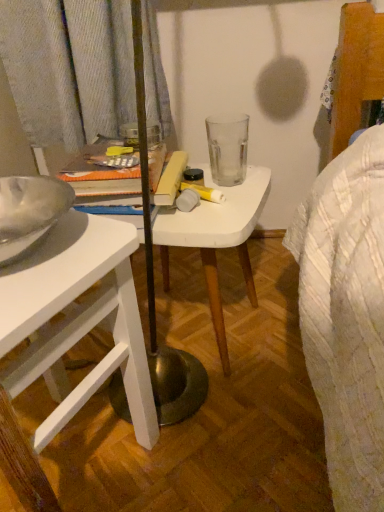
What do you see at coordinates (217, 240) in the screenshot?
I see `white matte table at center` at bounding box center [217, 240].

Find the location of a particular element. white matte table at center is located at coordinates (217, 240).

Based on the photo, what is the approximate height of white matte desk at left?

It is 17.75 inches.

What do you see at coordinates (70, 338) in the screenshot?
I see `white matte desk at left` at bounding box center [70, 338].

At what (x,y) coordinates should I click in order to perform the action: click on white matte desk at left. Please return your answer as a coordinate pair (x, y). Looking at the image, I should click on (70, 338).

The width and height of the screenshot is (384, 512). Identify the location of white matte table at center. (217, 240).

Is white matte table at center to the left or to the right of white matte desk at left in the image?

white matte table at center is positioned on white matte desk at left's right side.

Between white matte table at center and white matte desk at left, which one is positioned behind?

Positioned behind is white matte table at center.

Considering the points (203, 261) and (64, 240), which point is in front, point (203, 261) or point (64, 240)?

The point (64, 240) is closer.

From the image's perspective, which one is positioned higher, white matte table at center or white matte desk at left?

white matte table at center, from the image's perspective.

From a real-world perspective, does white matte table at center sit lower than white matte desk at left?

Yes, from a real-world perspective, white matte table at center is beneath white matte desk at left.

Which object is wider, white matte table at center or white matte desk at left?

With larger width is white matte desk at left.

From the picture: Is white matte table at center taller than white matte desk at left?

Incorrect, the height of white matte table at center is not larger of that of white matte desk at left.

Is white matte table at center smaller than white matte desk at left?

Correct, white matte table at center occupies less space than white matte desk at left.

Is white matte table at center situated inside white matte desk at left or outside?

white matte table at center lies outside white matte desk at left.

Would you say white matte table at center is a long distance from white matte desk at left?

No, white matte table at center is not far away from white matte desk at left.

Is white matte table at center turned away from white matte desk at left?

No.

I want to click on desk to the left of white matte table at center, so click(x=70, y=338).

In the image, is white matte desk at left on the left side or the right side of white matte table at center?

white matte desk at left is positioned on white matte table at center's left side.

Is white matte desk at left further to the viewer compared to white matte table at center?

No, white matte desk at left is closer to the camera.

Which is behind, point (13, 412) or point (208, 220)?

Point (208, 220)

From the image's perspective, which object appears higher, white matte desk at left or white matte table at center?

white matte table at center, from the image's perspective.

From a real-world perspective, is white matte desk at left positioned over white matte table at center based on gravity?

Indeed, from a real-world perspective, white matte desk at left stands above white matte table at center.

Considering the relative sizes of white matte desk at left and white matte table at center in the image provided, is white matte desk at left wider than white matte table at center?

Yes.

In terms of height, does white matte desk at left look taller or shorter compared to white matte table at center?

In the image, white matte desk at left appears to be taller than white matte table at center.

Considering the sizes of objects white matte desk at left and white matte table at center in the image provided, who is smaller, white matte desk at left or white matte table at center?

With smaller size is white matte table at center.

Is white matte desk at left outside of white matte table at center?

Absolutely, white matte desk at left is external to white matte table at center.

Is white matte desk at left positioned far away from white matte table at center?

No.

Could you tell me if white matte desk at left is facing white matte table at center?

No, white matte desk at left is not aimed at white matte table at center.

How many degrees apart are the facing directions of white matte desk at left and white matte table at center?

The angular difference between white matte desk at left and white matte table at center is 12.9 degrees.

Locate an element on the screen. This screenshot has height=512, width=384. table behind the white matte desk at left is located at coordinates (217, 240).

This screenshot has width=384, height=512. Find the location of `desk lying in front of the white matte table at center`. desk lying in front of the white matte table at center is located at coordinates (70, 338).

Identify the location of desk on the left side of white matte table at center. (70, 338).